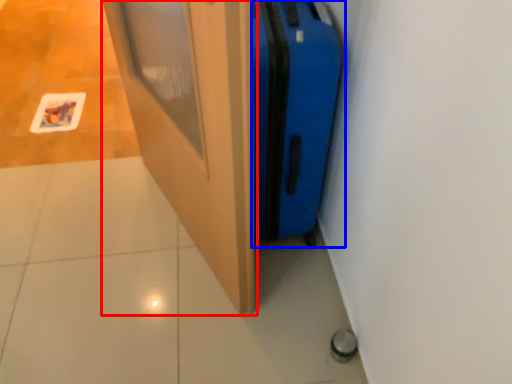
Question: Which of the following is the closest to the observer, door (highlighted by a red box) or luggage (highlighted by a blue box)?

Choices:
 (A) door
 (B) luggage

Answer: (A)